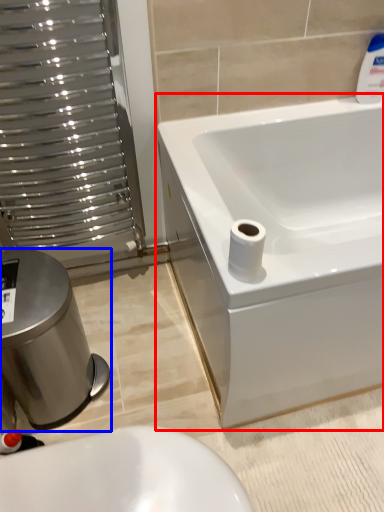
Question: Which of the following is the closest to the observer, bathtub (highlighted by a red box) or bidet (highlighted by a blue box)?

Choices:
 (A) bathtub
 (B) bidet

Answer: (A)